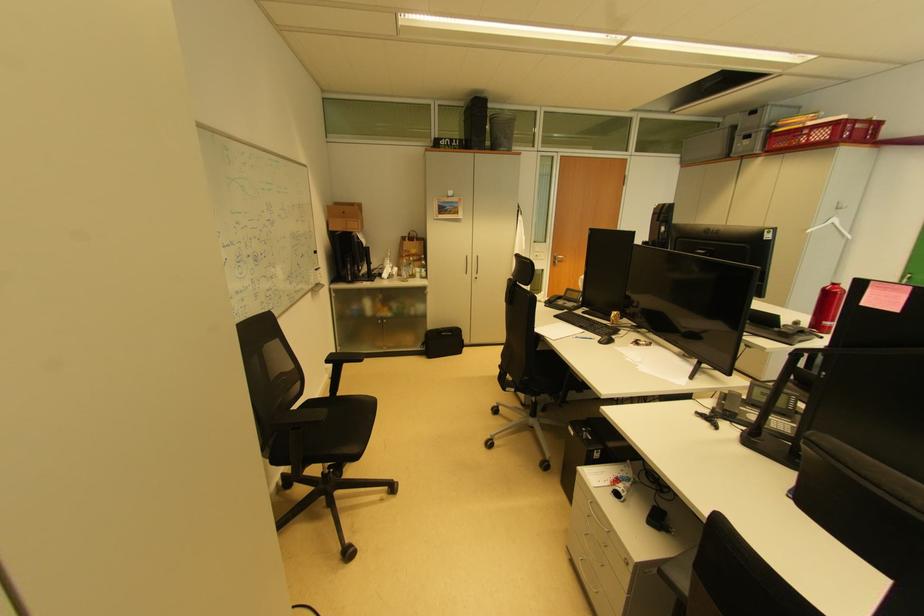
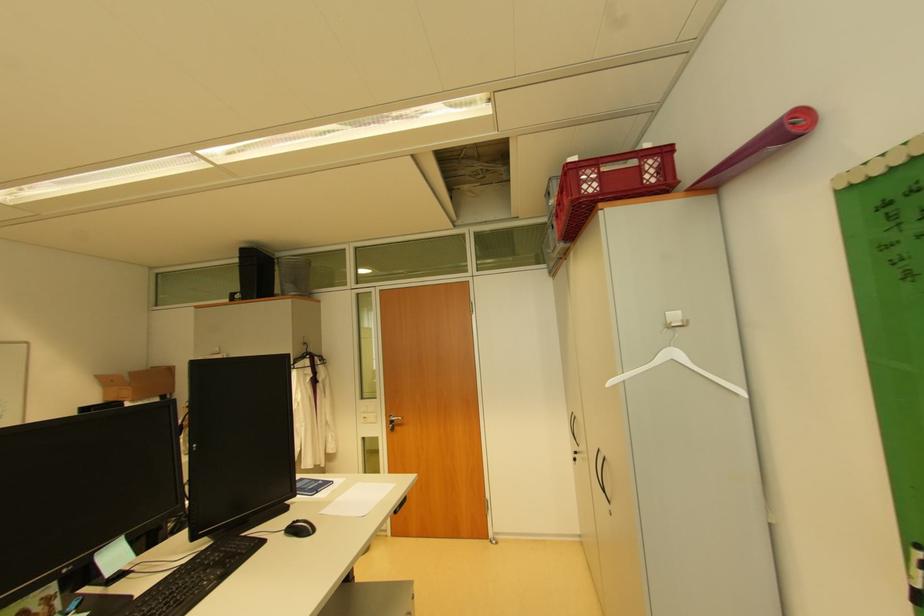
Which direction would the cameraman need to move to produce the second image?

The cameraman walked toward right, forward.